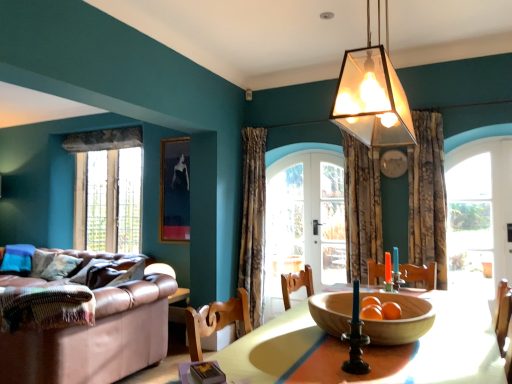
Question: Considering the relative sizes of clear glass window at left, the 1th window from the back, and textured floral fabric curtain at center, which appears as the third curtain when viewed from the left, in the image provided, is clear glass window at left, the 1th window from the back, smaller than textured floral fabric curtain at center, which appears as the third curtain when viewed from the left,?

Choices:
 (A) no
 (B) yes

Answer: (A)

Question: Is clear glass window at left, marked as the second window in a right-to-left arrangement, shorter than textured floral fabric curtain at center, which appears as the third curtain when viewed from the left?

Choices:
 (A) yes
 (B) no

Answer: (A)

Question: Is clear glass window at left, the 2th window viewed from the front, further to the viewer compared to textured floral fabric curtain at center, the first curtain positioned from the right?

Choices:
 (A) yes
 (B) no

Answer: (A)

Question: Does clear glass window at left, the 2th window viewed from the front, come in front of textured floral fabric curtain at center, which appears as the third curtain when viewed from the left?

Choices:
 (A) no
 (B) yes

Answer: (A)

Question: Can you confirm if clear glass window at left, the 2th window viewed from the front, is thinner than textured floral fabric curtain at center, which appears as the third curtain when viewed from the left?

Choices:
 (A) yes
 (B) no

Answer: (A)

Question: Is translucent glass pendant light at upper center taller or shorter than clear glass door at center?

Choices:
 (A) short
 (B) tall

Answer: (A)

Question: Looking at their shapes, would you say translucent glass pendant light at upper center is wider or thinner than clear glass door at center?

Choices:
 (A) wide
 (B) thin

Answer: (A)

Question: From a real-world perspective, relative to clear glass door at center, is translucent glass pendant light at upper center vertically above or below?

Choices:
 (A) above
 (B) below

Answer: (A)

Question: Considering the positions of translucent glass pendant light at upper center and clear glass door at center in the image, is translucent glass pendant light at upper center bigger or smaller than clear glass door at center?

Choices:
 (A) big
 (B) small

Answer: (A)

Question: From the image's perspective, is textured floral fabric curtain at center, which appears as the third curtain when viewed from the left, above or below translucent glass pendant light at upper center?

Choices:
 (A) below
 (B) above

Answer: (A)

Question: In the image, is textured floral fabric curtain at center, the first curtain positioned from the right, positioned in front of or behind translucent glass pendant light at upper center?

Choices:
 (A) front
 (B) behind

Answer: (B)

Question: Is textured floral fabric curtain at center, the first curtain positioned from the right, to the left or to the right of translucent glass pendant light at upper center in the image?

Choices:
 (A) right
 (B) left

Answer: (A)

Question: From their relative heights in the image, would you say textured floral fabric curtain at center, the first curtain positioned from the right, is taller or shorter than translucent glass pendant light at upper center?

Choices:
 (A) short
 (B) tall

Answer: (B)

Question: In terms of height, does clear glass window at right, which is counted as the second window, starting from the left, look taller or shorter compared to clear glass window at left, marked as the second window in a right-to-left arrangement?

Choices:
 (A) short
 (B) tall

Answer: (A)

Question: Is clear glass window at right, arranged as the first window when viewed from the right, to the left or to the right of clear glass window at left, the 1th window from the back, in the image?

Choices:
 (A) left
 (B) right

Answer: (B)